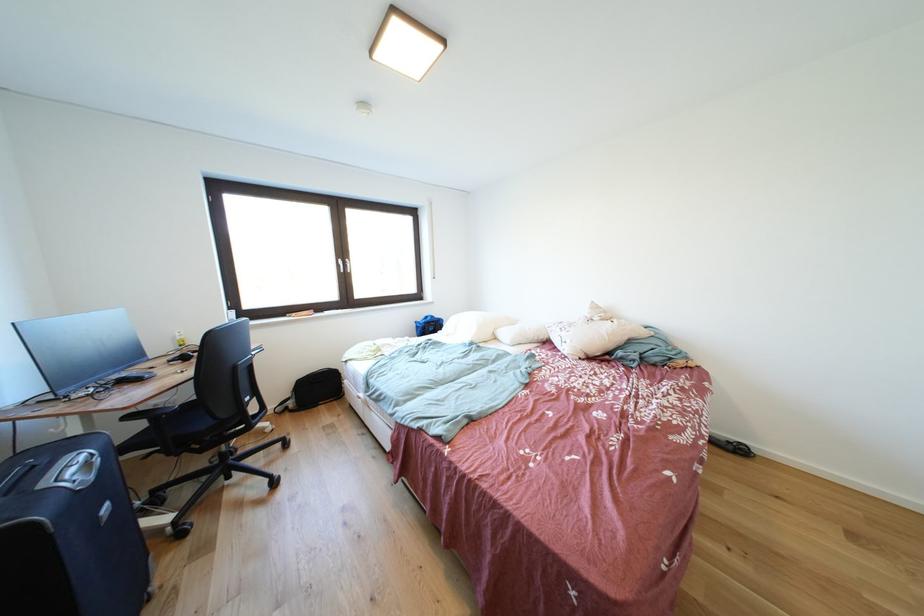
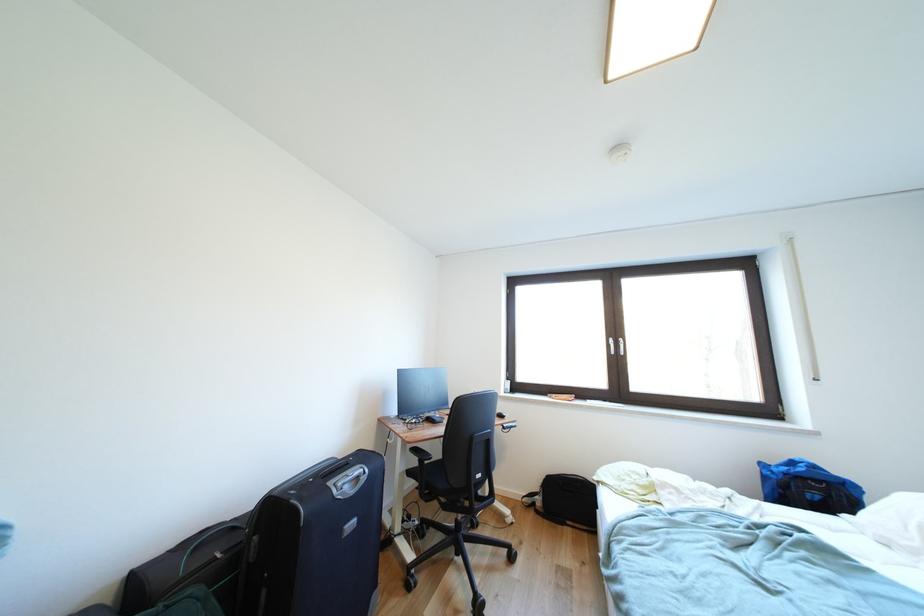
Question: The camera is either moving clockwise (left) or counter-clockwise (right) around the object. The first image is from the beginning of the video and the second image is from the end. Is the camera moving left or right when shooting the video?

Choices:
 (A) Left
 (B) Right

Answer: (B)